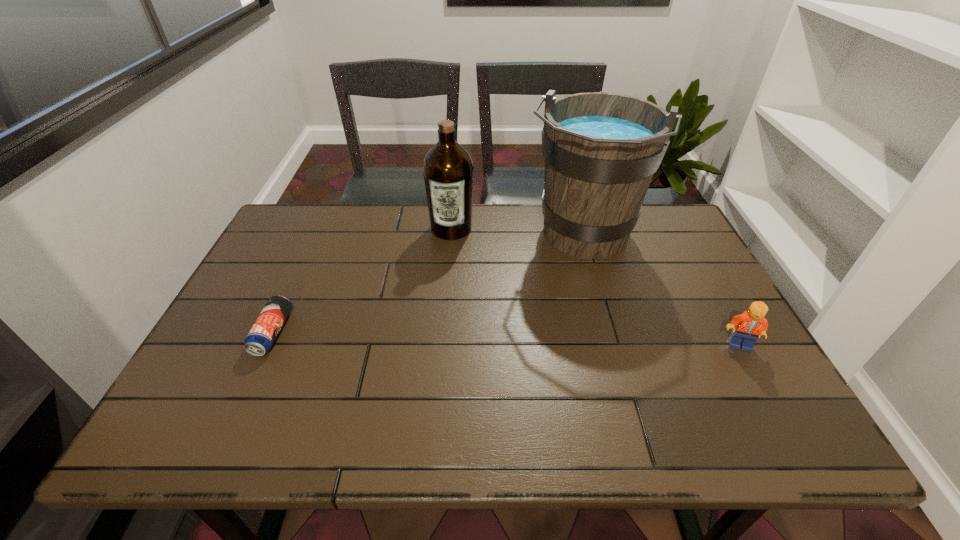
Image resolution: width=960 pixels, height=540 pixels. Identify the location of vacant area that lies between the wine bucket and the leftmost object. (427, 285).

Where is `vacant point located between the wine bucket and the rightmost object`? The height and width of the screenshot is (540, 960). vacant point located between the wine bucket and the rightmost object is located at coordinates (660, 291).

This screenshot has height=540, width=960. Find the location of `vacant space in between the third tallest object and the second object from left to right`. vacant space in between the third tallest object and the second object from left to right is located at coordinates (595, 287).

Where is `free space between the Lego and the beer can`? This screenshot has width=960, height=540. free space between the Lego and the beer can is located at coordinates (506, 339).

The image size is (960, 540). I want to click on empty space between the wine bucket and the Lego, so click(x=660, y=291).

Where is `free spot between the beer can and the Lego`? This screenshot has width=960, height=540. free spot between the beer can and the Lego is located at coordinates (506, 339).

At what (x,y) coordinates should I click in order to perform the action: click on empty space between the third object from right to left and the shortest object. Please return your answer as a coordinate pair (x, y). This screenshot has height=540, width=960. Looking at the image, I should click on (362, 281).

Select which object appears as the closest to the leftmost object. Please provide its 2D coordinates. Your answer should be formatted as a tuple, i.e. [(x, y)], where the tuple contains the x and y coordinates of a point satisfying the conditions above.

[(448, 170)]

This screenshot has height=540, width=960. Find the location of `object that is the closest to the shortest object`. object that is the closest to the shortest object is located at coordinates (448, 170).

Image resolution: width=960 pixels, height=540 pixels. Find the location of `vacant space that satisfies the following two spatial constraints: 1. on the back side of the shortest object; 2. on the right side of the tallest object`. vacant space that satisfies the following two spatial constraints: 1. on the back side of the shortest object; 2. on the right side of the tallest object is located at coordinates (317, 237).